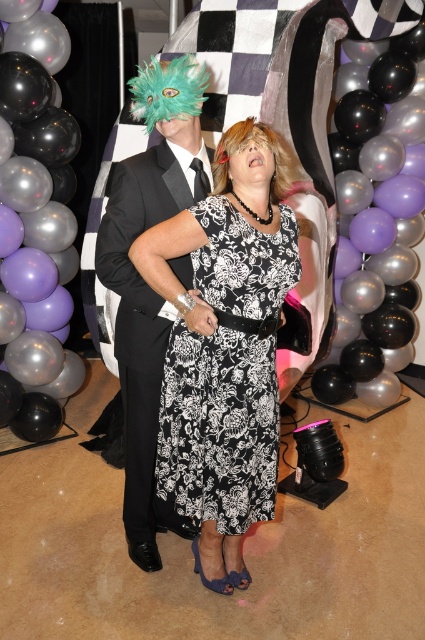
Question: Which object appears farthest from the camera in this image?

Choices:
 (A) black floral dress at center
 (B) black glossy balloon at center
 (C) black glossy balloons at upper center
 (D) matte black suit at center

Answer: (C)

Question: Which of the following is the closest to the observer?

Choices:
 (A) (331, 148)
 (B) (166, 164)
 (C) (251, 248)
 (D) (3, 42)

Answer: (C)

Question: Is black floral dress at center closer to camera compared to matte black suit at center?

Choices:
 (A) no
 (B) yes

Answer: (B)

Question: Is black floral dress at center to the right of black glossy balloon at center from the viewer's perspective?

Choices:
 (A) yes
 (B) no

Answer: (A)

Question: Does black glossy balloons at upper center have a greater width compared to matte black suit at center?

Choices:
 (A) no
 (B) yes

Answer: (B)

Question: Which point is farther to the camera?

Choices:
 (A) (357, 83)
 (B) (45, 285)
 (C) (297, 250)

Answer: (A)